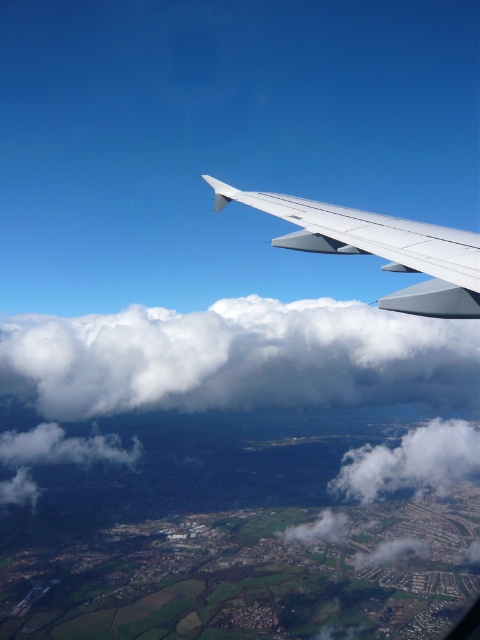
Question: Estimate the real-world distances between objects in this image. Which object is closer to the white matte wing at upper center?

Choices:
 (A) white fluffy cloud at upper center
 (B) white fluffy cloud at lower right

Answer: (A)

Question: Can you confirm if white fluffy cloud at upper center is thinner than white matte wing at upper center?

Choices:
 (A) no
 (B) yes

Answer: (A)

Question: Which of the following is the farthest from the observer?

Choices:
 (A) white fluffy cloud at upper center
 (B) white matte wing at upper center

Answer: (A)

Question: Can you confirm if white matte wing at upper center is thinner than white fluffy cloud at lower right?

Choices:
 (A) no
 (B) yes

Answer: (B)

Question: Can you confirm if white fluffy cloud at upper center is positioned above white matte wing at upper center?

Choices:
 (A) yes
 (B) no

Answer: (B)

Question: Considering the real-world distances, which object is farthest from the white matte wing at upper center?

Choices:
 (A) white fluffy cloud at upper center
 (B) white fluffy cloud at lower right

Answer: (B)